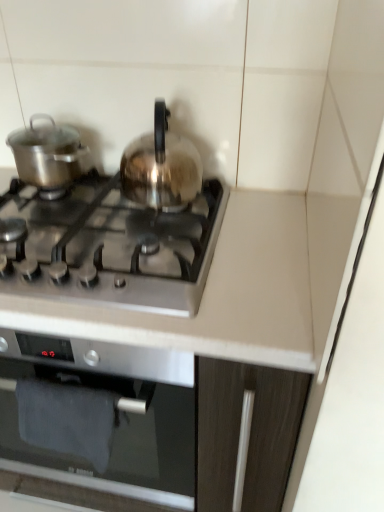
Question: Is shiny silver pot at left, the first kitchen appliance when ordered from left to right, not close to satin silver kettle at center, the second kitchen appliance when ordered from left to right?

Choices:
 (A) yes
 (B) no

Answer: (B)

Question: Is the position of shiny silver pot at left, the first kitchen appliance when ordered from left to right, less distant than that of satin silver kettle at center, marked as the first kitchen appliance in a right-to-left arrangement?

Choices:
 (A) no
 (B) yes

Answer: (A)

Question: Does shiny silver pot at left, acting as the second kitchen appliance starting from the right, have a greater height compared to satin silver kettle at center, the second kitchen appliance when ordered from left to right?

Choices:
 (A) yes
 (B) no

Answer: (B)

Question: From the image's perspective, is shiny silver pot at left, the first kitchen appliance when ordered from left to right, over satin silver kettle at center, the second kitchen appliance when ordered from left to right?

Choices:
 (A) yes
 (B) no

Answer: (A)

Question: Does shiny silver pot at left, acting as the second kitchen appliance starting from the right, turn towards satin silver kettle at center, the second kitchen appliance when ordered from left to right?

Choices:
 (A) yes
 (B) no

Answer: (B)

Question: Is shiny silver pot at left, acting as the second kitchen appliance starting from the right, bigger than satin silver kettle at center, marked as the first kitchen appliance in a right-to-left arrangement?

Choices:
 (A) yes
 (B) no

Answer: (B)

Question: Is satin silver kettle at center, marked as the first kitchen appliance in a right-to-left arrangement, outside shiny silver pot at left, acting as the second kitchen appliance starting from the right?

Choices:
 (A) yes
 (B) no

Answer: (A)

Question: From a real-world perspective, is satin silver kettle at center, the second kitchen appliance when ordered from left to right, on shiny silver pot at left, the first kitchen appliance when ordered from left to right?

Choices:
 (A) yes
 (B) no

Answer: (A)

Question: Can you confirm if satin silver kettle at center, marked as the first kitchen appliance in a right-to-left arrangement, is shorter than shiny silver pot at left, acting as the second kitchen appliance starting from the right?

Choices:
 (A) yes
 (B) no

Answer: (B)

Question: Is satin silver kettle at center, marked as the first kitchen appliance in a right-to-left arrangement, facing towards shiny silver pot at left, the first kitchen appliance when ordered from left to right?

Choices:
 (A) yes
 (B) no

Answer: (B)

Question: From the image's perspective, would you say satin silver kettle at center, the second kitchen appliance when ordered from left to right, is shown under shiny silver pot at left, acting as the second kitchen appliance starting from the right?

Choices:
 (A) no
 (B) yes

Answer: (B)

Question: Does satin silver kettle at center, marked as the first kitchen appliance in a right-to-left arrangement, appear on the right side of shiny silver pot at left, acting as the second kitchen appliance starting from the right?

Choices:
 (A) yes
 (B) no

Answer: (A)

Question: Considering the relative sizes of satin silver gas stove at center and shiny silver pot at left, the first kitchen appliance when ordered from left to right, in the image provided, is satin silver gas stove at center wider than shiny silver pot at left, the first kitchen appliance when ordered from left to right,?

Choices:
 (A) no
 (B) yes

Answer: (B)